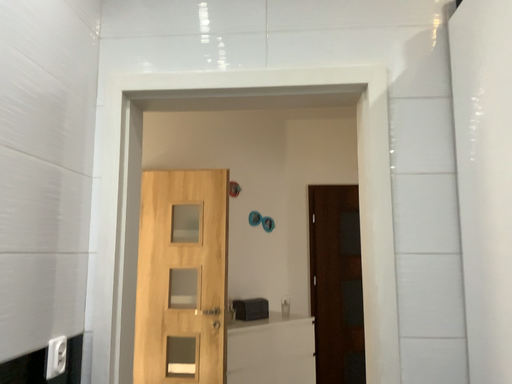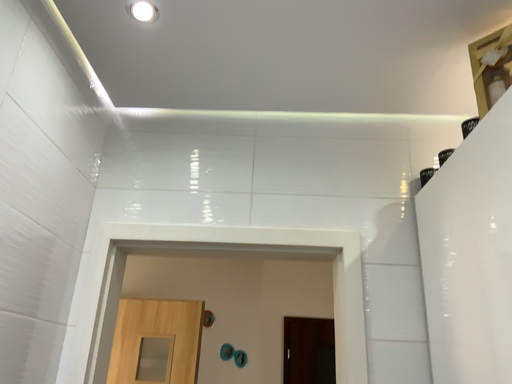
Question: Which way did the camera rotate in the video?

Choices:
 (A) rotated downward
 (B) rotated upward

Answer: (B)